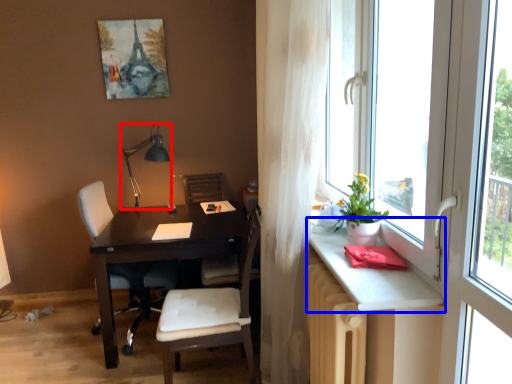
Question: Which of the following is the closest to the observer, table lamp (highlighted by a red box) or table (highlighted by a blue box)?

Choices:
 (A) table lamp
 (B) table

Answer: (B)